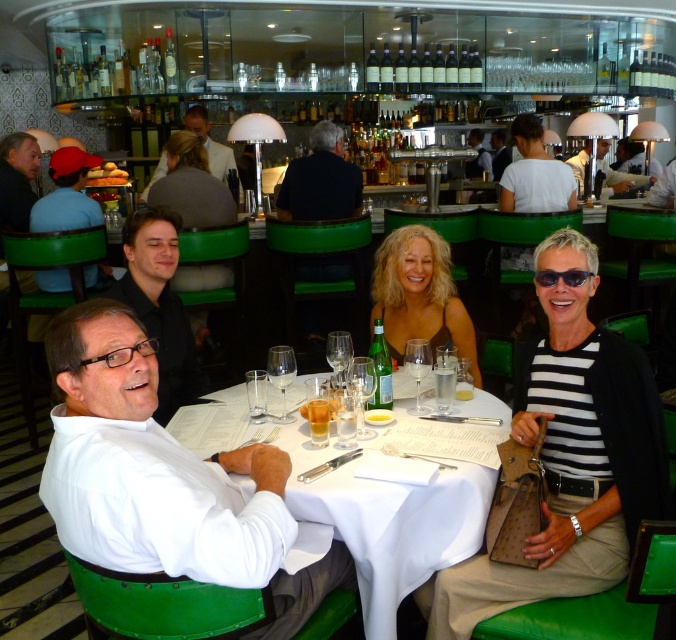
Question: In this image, where is matte blue shirt at left located relative to dark brown leather jacket at upper center?

Choices:
 (A) above
 (B) below

Answer: (B)

Question: Can you confirm if white cloth table at center is positioned below matte blue shirt at left?

Choices:
 (A) yes
 (B) no

Answer: (A)

Question: Which object is positioned farthest from the white cloth table at center?

Choices:
 (A) dark blue shirt at center
 (B) black shirt at upper left
 (C) white cotton shirt at upper center
 (D) dark brown leather jacket at upper center

Answer: (D)

Question: Which object appears farthest from the camera in this image?

Choices:
 (A) light brown leather jacket at upper center
 (B) white cloth table at center

Answer: (A)

Question: Which point is farther to the camera?

Choices:
 (A) (216, 176)
 (B) (339, 166)

Answer: (A)

Question: Is black shirt at upper left positioned behind blonde hair at upper center?

Choices:
 (A) no
 (B) yes

Answer: (A)